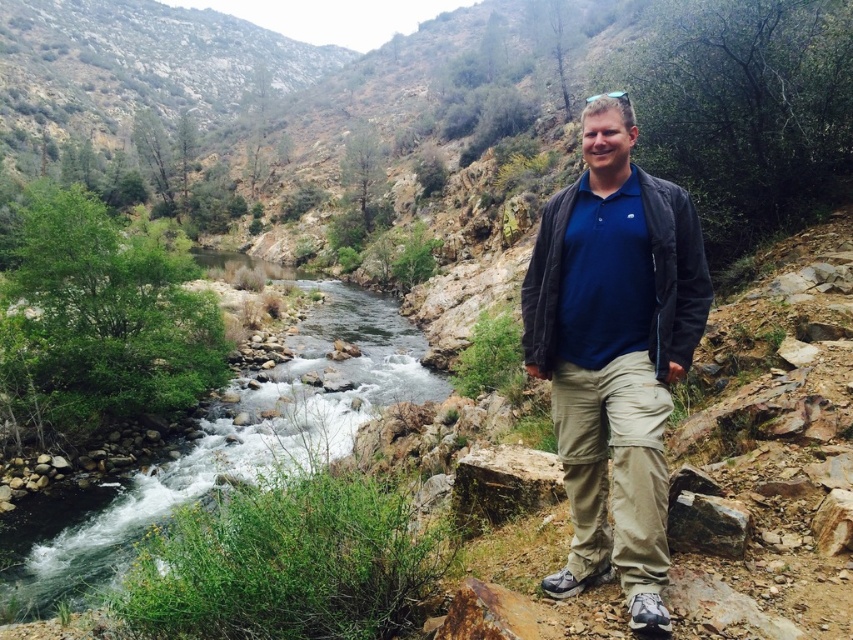
Question: Does matte blue shirt at center come behind green rocky stream at left?

Choices:
 (A) no
 (B) yes

Answer: (A)

Question: Which of the following is the closest to the observer?

Choices:
 (A) (613, 403)
 (B) (206, 438)

Answer: (A)

Question: Which of the following is the farthest from the observer?

Choices:
 (A) coord(581,444)
 (B) coord(347,436)

Answer: (B)

Question: Can you confirm if matte blue shirt at center is bigger than green rocky stream at left?

Choices:
 (A) yes
 (B) no

Answer: (B)

Question: Can you confirm if matte blue shirt at center is positioned to the left of green rocky stream at left?

Choices:
 (A) no
 (B) yes

Answer: (A)